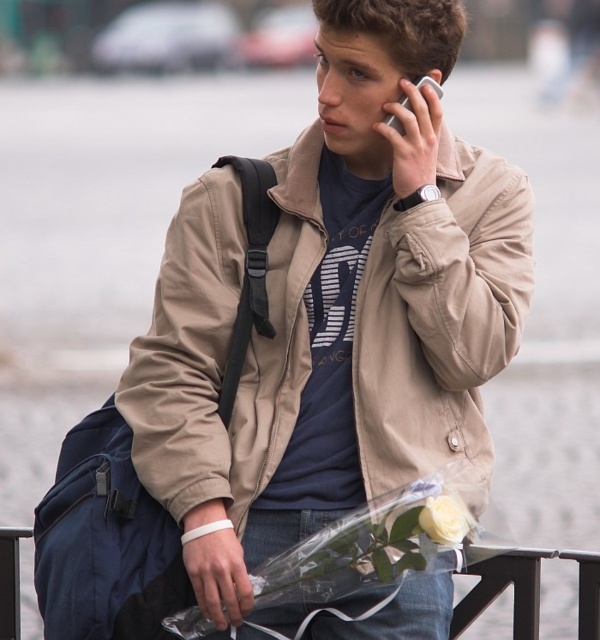
Based on the scene description, can you determine the spatial relationship between the tan fabric jacket at center and the clear plastic rail at lower center?

The tan fabric jacket at center is to the left of the clear plastic rail at lower center.

You are a delivery person who needs to place a package on the clear plastic rail at lower center. The package is 1.2 meters tall. Can the navy blue fabric backpack at lower left fit underneath it without being obstructed?

The navy blue fabric backpack at lower left is shorter than the clear plastic rail at lower center. Since the package is 1.2 meters tall, the backpack can fit underneath as long as its height is less than 1.2 meters. However, the exact height of the backpack isn

You are a photographer trying to capture a candid shot of the man without him noticing. You want to frame the shot so that the navy blue fabric backpack at lower left and the silver metallic smartphone at upper right are both visible. Based on their positions, where should you position the smartphone relative to the backpack in the frame?

The silver metallic smartphone at upper right is positioned above the navy blue fabric backpack at lower left, so you should place the smartphone higher up in the frame relative to the backpack to ensure both are visible.